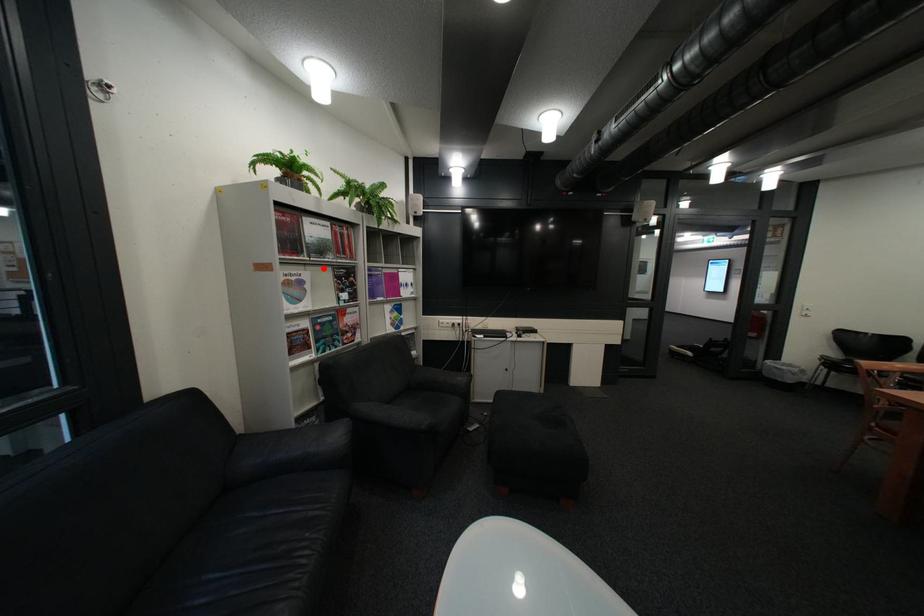
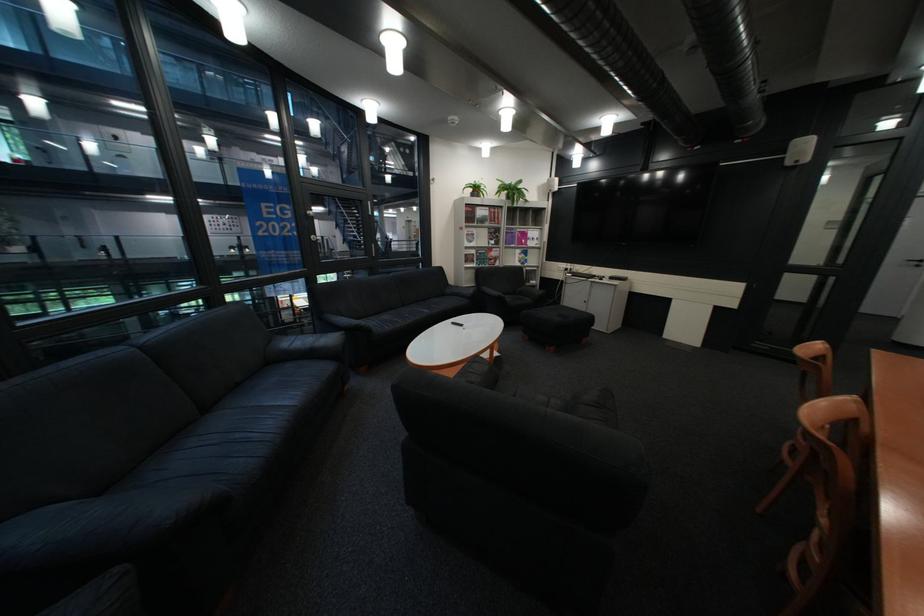
The point at the highlighted location is marked in the first image. Where is the corresponding point in the second image?

(492, 229)